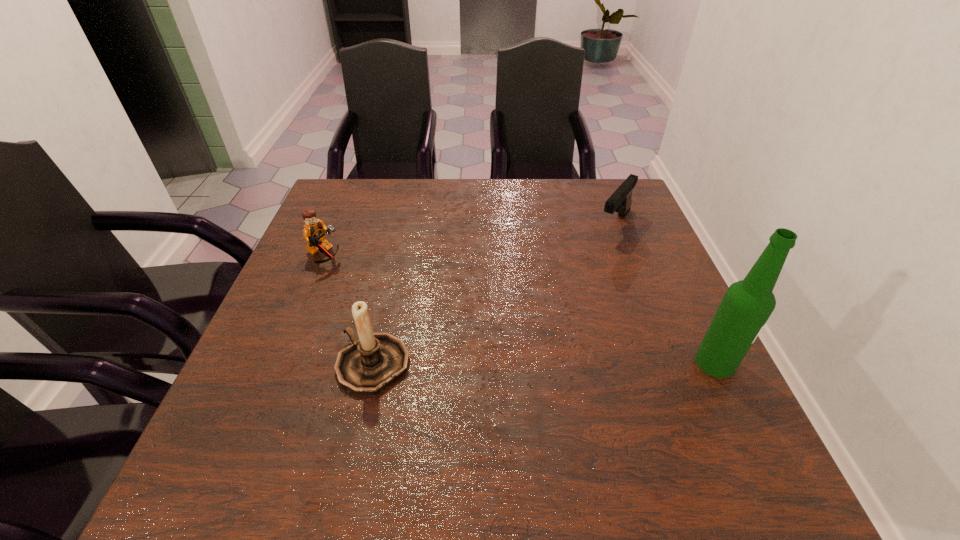
Find the location of `vacant space that's between the Lego and the pistol`. vacant space that's between the Lego and the pistol is located at coordinates (469, 240).

You are a GUI agent. You are given a task and a screenshot of the screen. Output one action in this format:
    pyautogui.click(x=<x>, y=<y>)
    Task: Click on the free spot between the leftmost object and the beer bottle
    The image size is (960, 540).
    Given the screenshot: What is the action you would take?
    pyautogui.click(x=520, y=309)

Identify the location of free space between the leftmost object and the beer bottle. The image size is (960, 540). (520, 309).

Locate an element on the screen. The height and width of the screenshot is (540, 960). object that is the second closest to the third object from right to left is located at coordinates (620, 201).

Select which object appears as the third closest to the third shortest object. Please provide its 2D coordinates. Your answer should be formatted as a tuple, i.e. [(x, y)], where the tuple contains the x and y coordinates of a point satisfying the conditions above.

[(747, 304)]

Where is `vacant space that satisfies the following two spatial constraints: 1. on the front side of the Lego; 2. on the label of the beer bottle`? The width and height of the screenshot is (960, 540). vacant space that satisfies the following two spatial constraints: 1. on the front side of the Lego; 2. on the label of the beer bottle is located at coordinates (x=281, y=362).

Identify the location of free location that satisfies the following two spatial constraints: 1. on the front side of the tallest object; 2. on the label of the leftmost object. Image resolution: width=960 pixels, height=540 pixels. (281, 362).

Find the location of `vacant region that satisfies the following two spatial constraints: 1. on the back side of the third shortest object; 2. on the label of the beer bottle`. vacant region that satisfies the following two spatial constraints: 1. on the back side of the third shortest object; 2. on the label of the beer bottle is located at coordinates (373, 362).